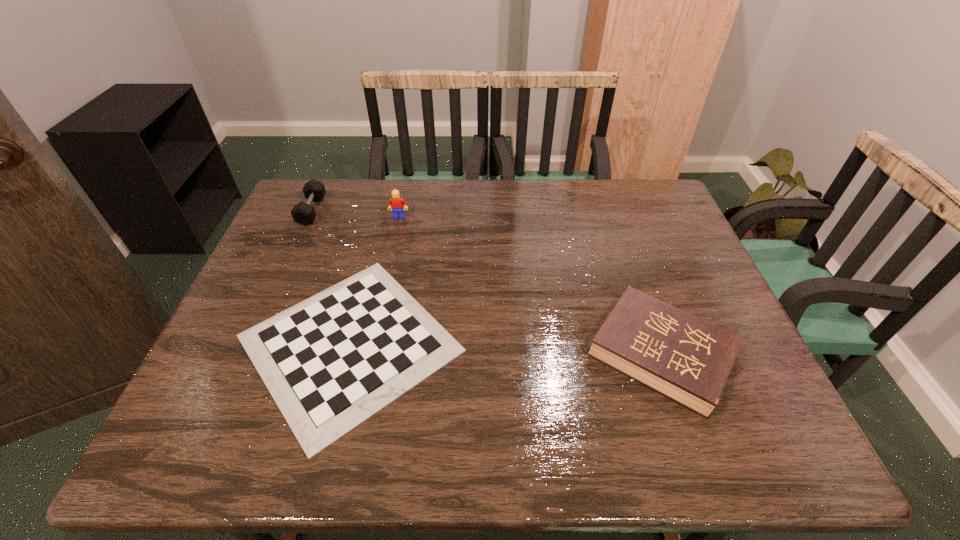
This screenshot has height=540, width=960. I want to click on free space that is in between the Lego and the dumbbell, so click(x=355, y=214).

The image size is (960, 540). What are the coordinates of `free space that is in between the tallest object and the dumbbell` in the screenshot? It's located at click(x=355, y=214).

Locate an element on the screen. The image size is (960, 540). unoccupied area between the Lego and the hardback book is located at coordinates click(x=530, y=286).

Identify which object is the third closest to the dumbbell. Please provide its 2D coordinates. Your answer should be formatted as a tuple, i.e. [(x, y)], where the tuple contains the x and y coordinates of a point satisfying the conditions above.

[(684, 358)]

At what (x,y) coordinates should I click in order to perform the action: click on object that is the third closest to the Lego. Please return your answer as a coordinate pair (x, y). Looking at the image, I should click on (684, 358).

The width and height of the screenshot is (960, 540). Find the location of `vacant region that satisfies the following two spatial constraints: 1. on the face of the rightmost object; 2. on the left side of the tallest object`. vacant region that satisfies the following two spatial constraints: 1. on the face of the rightmost object; 2. on the left side of the tallest object is located at coordinates (370, 354).

Where is `free location that satisfies the following two spatial constraints: 1. on the front side of the second shortest object; 2. on the right side of the dumbbell`? The width and height of the screenshot is (960, 540). free location that satisfies the following two spatial constraints: 1. on the front side of the second shortest object; 2. on the right side of the dumbbell is located at coordinates (248, 354).

At what (x,y) coordinates should I click in order to perform the action: click on free space that satisfies the following two spatial constraints: 1. on the face of the rightmost object; 2. on the right side of the tallest object. Please return your answer as a coordinate pair (x, y). The height and width of the screenshot is (540, 960). Looking at the image, I should click on (370, 354).

Locate an element on the screen. free spot that satisfies the following two spatial constraints: 1. on the face of the Lego; 2. on the left side of the rightmost object is located at coordinates (370, 354).

Find the location of a particular element. This screenshot has height=540, width=960. vacant space that satisfies the following two spatial constraints: 1. on the front side of the dumbbell; 2. on the right side of the third tallest object is located at coordinates (248, 354).